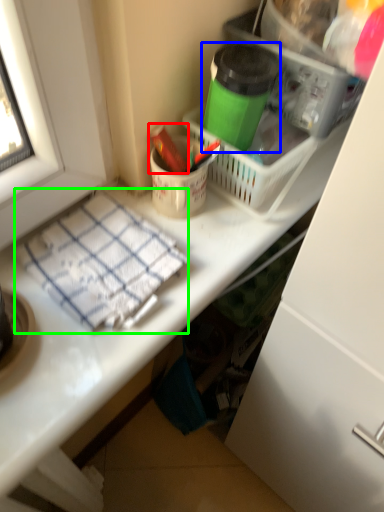
Question: Which is farther away from crayon (highlighted by a red box)? bottle (highlighted by a blue box) or blanket (highlighted by a green box)?

Choices:
 (A) bottle
 (B) blanket

Answer: (B)